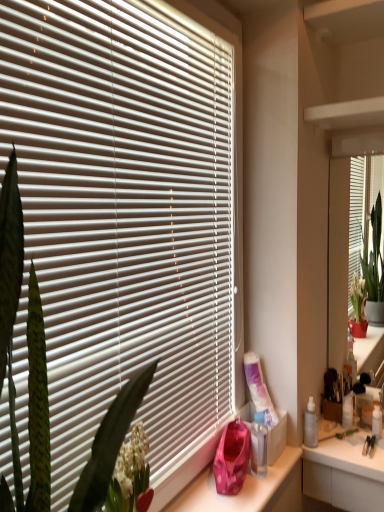
This screenshot has width=384, height=512. In order to click on white glossy counter at lower right in this screenshot , I will do `click(345, 474)`.

Locate an element on the screen. white plastic bottle at right, which appears as the 1th toiletry when viewed from the right is located at coordinates [x=347, y=411].

Where is `white plastic blinds at center`? This screenshot has width=384, height=512. white plastic blinds at center is located at coordinates coord(124,216).

What is the approximate width of green leafy plant at left?

It is 12.29 inches.

Where is `white glossy counter at lower right`? The height and width of the screenshot is (512, 384). white glossy counter at lower right is located at coordinates (345, 474).

From a real-world perspective, is white glossy counter at lower right beneath clear plastic bottle at lower right?

Yes.

Can you confirm if white glossy counter at lower right is bigger than clear plastic bottle at lower right?

Yes, white glossy counter at lower right is bigger than clear plastic bottle at lower right.

Which object is more forward, white glossy counter at lower right or clear plastic bottle at lower right?

clear plastic bottle at lower right.

Is white glossy counter at lower right taller than clear plastic bottle at lower right?

Correct, white glossy counter at lower right is much taller as clear plastic bottle at lower right.

How different are the orientations of white plastic blinds at center and green leafy plant at left in degrees?

The angular difference between white plastic blinds at center and green leafy plant at left is 0.00116 degrees.

Based on the photo, is white plastic blinds at center far away from green leafy plant at left?

That's not correct — white plastic blinds at center is a little close to green leafy plant at left.

This screenshot has height=512, width=384. I want to click on plant in front of the white plastic blinds at center, so click(28, 348).

Is white plastic blinds at center turned away from green leafy plant at left?

white plastic blinds at center is not turned away from green leafy plant at left.

Is matte white mirror at right to the left of white plastic bottle at right, the second toiletry in the front-to-back sequence, from the viewer's perspective?

Incorrect, matte white mirror at right is not on the left side of white plastic bottle at right, the second toiletry in the front-to-back sequence.

Looking at this image, which is behind, matte white mirror at right or white plastic bottle at right, which appears as the 1th toiletry when viewed from the right?

white plastic bottle at right, which appears as the 1th toiletry when viewed from the right, is further from the camera.

Is white plastic bottle at right, the second toiletry in the front-to-back sequence, at the back of matte white mirror at right?

Correct, matte white mirror at right is looking away from white plastic bottle at right, the second toiletry in the front-to-back sequence.

Does white glossy counter at lower right contain translucent plastic spray bottle at right, which is counted as the first toiletry, starting from the left?

No, white glossy counter at lower right does not contain translucent plastic spray bottle at right, which is counted as the first toiletry, starting from the left.

From the picture: From their relative heights in the image, would you say white glossy counter at lower right is taller or shorter than translucent plastic spray bottle at right, which is counted as the first toiletry, starting from the left?

In the image, white glossy counter at lower right appears to be taller than translucent plastic spray bottle at right, which is counted as the first toiletry, starting from the left.

From the image's perspective, which one is positioned lower, white glossy counter at lower right or translucent plastic spray bottle at right, which is the second toiletry from right to left?

white glossy counter at lower right, from the image's perspective.

Can you confirm if white glossy counter at lower right is positioned to the right of translucent plastic spray bottle at right, the first toiletry positioned from the front?

Correct, you'll find white glossy counter at lower right to the right of translucent plastic spray bottle at right, the first toiletry positioned from the front.

Identify the location of counter below the green leafy plant at left (from the image's perspective). The height and width of the screenshot is (512, 384). (345, 474).

Is green leafy plant at left thinner than white glossy counter at lower right?

Correct, the width of green leafy plant at left is less than that of white glossy counter at lower right.

Which of these two, green leafy plant at left or white glossy counter at lower right, is smaller?

Smaller between the two is white glossy counter at lower right.

Considering the sizes of matte white mirror at right and green leafy plant at left in the image, is matte white mirror at right taller or shorter than green leafy plant at left?

Clearly, matte white mirror at right is taller compared to green leafy plant at left.

Would you consider matte white mirror at right to be distant from green leafy plant at left?

Yes, matte white mirror at right is far from green leafy plant at left.

In the scene shown: Can you tell me how much matte white mirror at right and green leafy plant at left differ in facing direction?

matte white mirror at right and green leafy plant at left are facing 89.5 degrees away from each other.

From a real-world perspective, does matte white mirror at right stand above green leafy plant at left?

Incorrect, from a real-world perspective, matte white mirror at right is lower than green leafy plant at left.

Between clear plastic bottle at lower right and green leafy plant at left, which one has smaller width?

clear plastic bottle at lower right.

Which object is further away from the camera, clear plastic bottle at lower right or green leafy plant at left?

clear plastic bottle at lower right is further from the camera.

From a real-world perspective, is clear plastic bottle at lower right physically above green leafy plant at left?

No, from a real-world perspective, clear plastic bottle at lower right is not over green leafy plant at left

Is clear plastic bottle at lower right outside of green leafy plant at left?

clear plastic bottle at lower right is positioned outside green leafy plant at left.

Identify the location of bottle that is on the left side of white glossy counter at lower right. The width and height of the screenshot is (384, 512). 259,445.

I want to click on window blind lying behind the green leafy plant at left, so click(x=124, y=216).

Based on their spatial positions, is clear plastic bottle at lower right or green leafy plant at left further from matte white mirror at right?

Among the two, green leafy plant at left is located further to matte white mirror at right.

Considering their positions, is clear plastic bottle at lower right positioned further to green leafy plant at left than white plastic blinds at center?

clear plastic bottle at lower right is positioned further to the anchor green leafy plant at left.

When comparing their distances from clear plastic bottle at lower right, does green leafy plant at left or white glossy counter at lower right seem further?

green leafy plant at left lies further to clear plastic bottle at lower right than the other object.

Estimate the real-world distances between objects in this image. Which object is further from translucent plastic spray bottle at right, which is counted as the first toiletry, starting from the left, white glossy counter at lower right or white plastic blinds at center?

The object further to translucent plastic spray bottle at right, which is counted as the first toiletry, starting from the left, is white plastic blinds at center.

Based on their spatial positions, is translucent plastic spray bottle at right, the first toiletry positioned from the front, or white glossy counter at lower right further from white plastic blinds at center?

translucent plastic spray bottle at right, the first toiletry positioned from the front, is further to white plastic blinds at center.

Looking at the image, which one is located further to matte white mirror at right, white plastic blinds at center or white glossy counter at lower right?

Based on the image, white plastic blinds at center appears to be further to matte white mirror at right.

In the scene shown: Looking at the image, which one is located further to white glossy counter at lower right, translucent plastic spray bottle at right, which is the second toiletry from right to left, or clear plastic bottle at lower right?

Among the two, clear plastic bottle at lower right is located further to white glossy counter at lower right.

Consider the image. Estimate the real-world distances between objects in this image. Which object is closer to white glossy counter at lower right, white plastic bottle at right, which is the 2th toiletry from left to right, or clear plastic bottle at lower right?

white plastic bottle at right, which is the 2th toiletry from left to right, lies closer to white glossy counter at lower right than the other object.

Where is `bay window between white plastic blinds at center and white plastic bottle at right, which is the 2th toiletry from left to right, along the z-axis`? bay window between white plastic blinds at center and white plastic bottle at right, which is the 2th toiletry from left to right, along the z-axis is located at coordinates (342, 233).

Locate an element on the screen. This screenshot has height=512, width=384. counter between white plastic blinds at center and white plastic bottle at right, which appears as the first toiletry when viewed from the back, along the z-axis is located at coordinates (345, 474).

Where is `toiletry between clear plastic bottle at lower right and white glossy counter at lower right from left to right`? toiletry between clear plastic bottle at lower right and white glossy counter at lower right from left to right is located at coordinates (311, 425).

Find the location of a particular element. This screenshot has height=512, width=384. toiletry between matte white mirror at right and white plastic bottle at right, which appears as the first toiletry when viewed from the back, in the up-down direction is located at coordinates (311, 425).